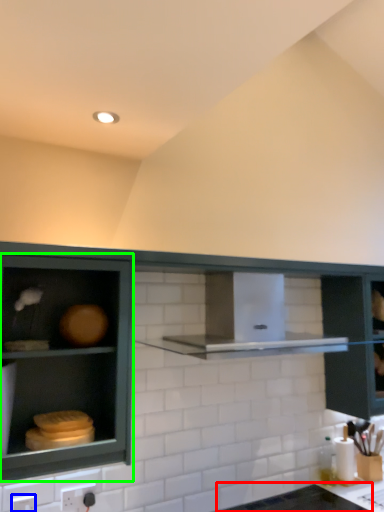
Question: Estimate the real-world distances between objects in this image. Which object is closer to counter top (highlighted by a red box), electric outlet (highlighted by a blue box) or cabinetry (highlighted by a green box)?

Choices:
 (A) electric outlet
 (B) cabinetry

Answer: (B)